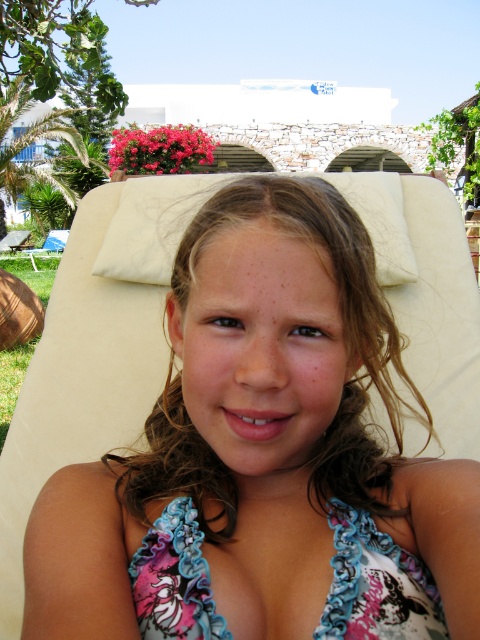
Which of these two, pink floral swimsuit at center or floral fabric bikini top at center, stands taller?

Standing taller between the two is pink floral swimsuit at center.

Does point (211, 200) lie in front of point (384, 582)?

That is False.

Is point (372, 364) farther from camera compared to point (204, 618)?

Yes, it is behind point (204, 618).

Locate an element on the screen. pink floral swimsuit at center is located at coordinates (263, 456).